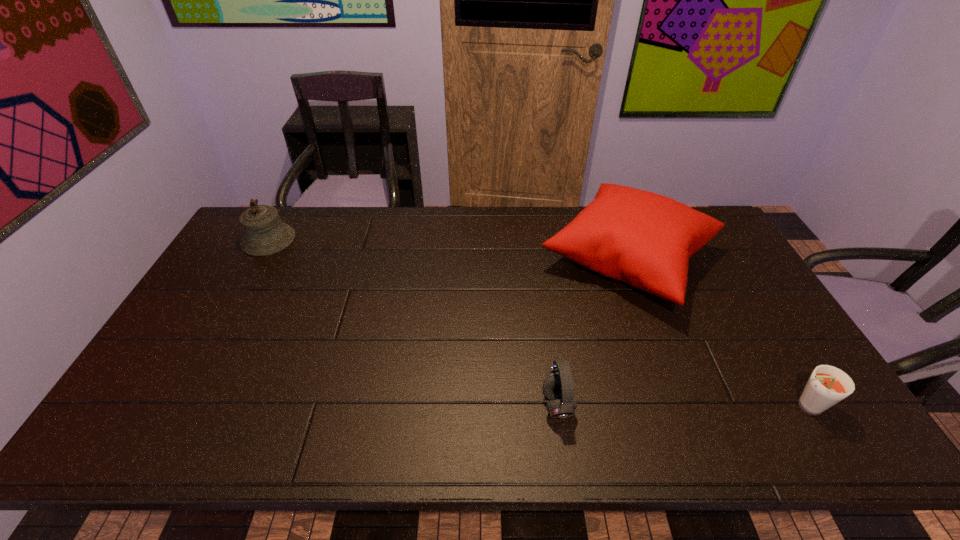
At what (x,y) coordinates should I click in order to perform the action: click on object located in the far right corner section of the desktop. Please return your answer as a coordinate pair (x, y). The width and height of the screenshot is (960, 540). Looking at the image, I should click on (645, 239).

Find the location of a particular element. This screenshot has height=540, width=960. object that is positioned at the near right corner is located at coordinates (827, 386).

Where is `vacant point at the far edge`? This screenshot has height=540, width=960. vacant point at the far edge is located at coordinates (441, 224).

Locate an element on the screen. This screenshot has width=960, height=540. vacant space at the left edge of the desktop is located at coordinates (241, 306).

Locate an element on the screen. The height and width of the screenshot is (540, 960). free region at the right edge is located at coordinates (798, 381).

What are the coordinates of `free space that is in between the root beer and the headset` in the screenshot? It's located at 681,406.

Identify the location of vacant area that lies between the root beer and the cushion. (717, 333).

Where is `vacant space in between the root beer and the headset`? This screenshot has height=540, width=960. vacant space in between the root beer and the headset is located at coordinates (681, 406).

At what (x,y) coordinates should I click in order to perform the action: click on free space between the cushion and the headset. Please return your answer as a coordinate pair (x, y). Looking at the image, I should click on (593, 332).

Find the location of a particular element. The width and height of the screenshot is (960, 540). empty location between the root beer and the headset is located at coordinates [x=681, y=406].